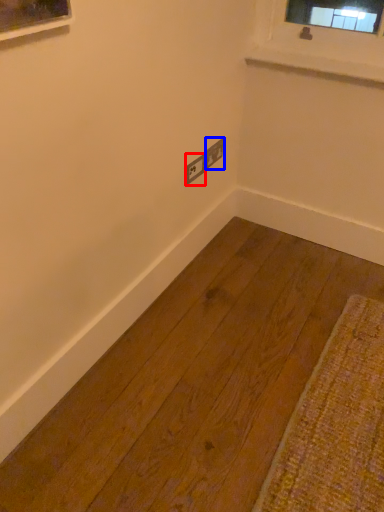
Question: Which point is closer to the camera, electric outlet (highlighted by a red box) or electric outlet (highlighted by a blue box)?

Choices:
 (A) electric outlet
 (B) electric outlet

Answer: (A)